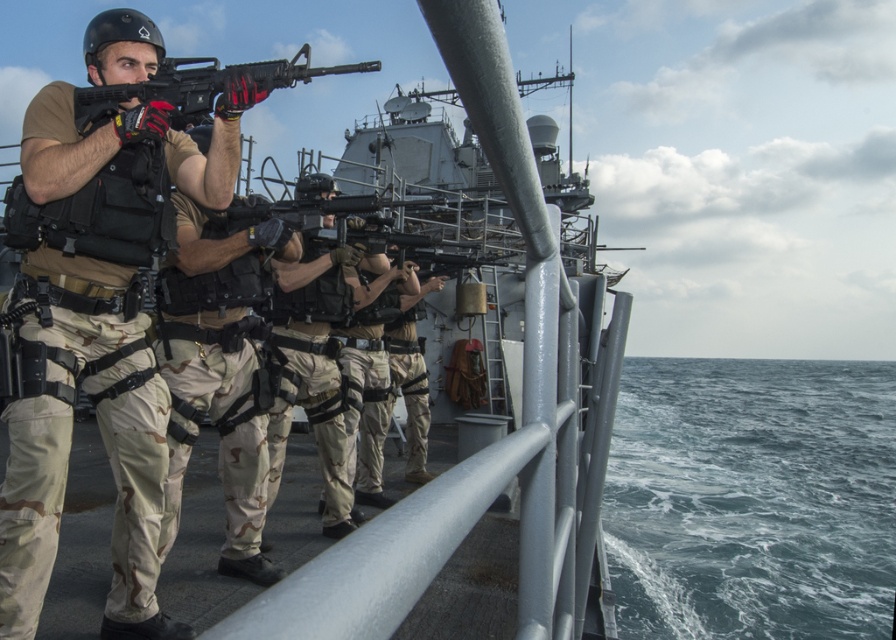
Question: Which point appears closest to the camera in this image?

Choices:
 (A) (550, 314)
 (B) (240, 435)
 (C) (346, 481)

Answer: (A)

Question: Which object is farther from the camera taking this photo?

Choices:
 (A) blue water at lower right
 (B) camouflage fabric uniform at center
 (C) camouflage pants at center

Answer: (A)

Question: Considering the relative positions of camouflage fabric pants at center and matte black rifle at center in the image provided, where is camouflage fabric pants at center located with respect to matte black rifle at center?

Choices:
 (A) left
 (B) right

Answer: (B)

Question: Is metallic gray boat at center thinner than camouflage pants at center?

Choices:
 (A) no
 (B) yes

Answer: (B)

Question: Does camouflage fabric pants at center have a larger size compared to metallic gray boat at center?

Choices:
 (A) no
 (B) yes

Answer: (B)

Question: Estimate the real-world distances between objects in this image. Which object is closer to the camouflage fabric pants at center?

Choices:
 (A) blue water at lower right
 (B) camouflage pants at center
 (C) metallic gray boat at center

Answer: (B)